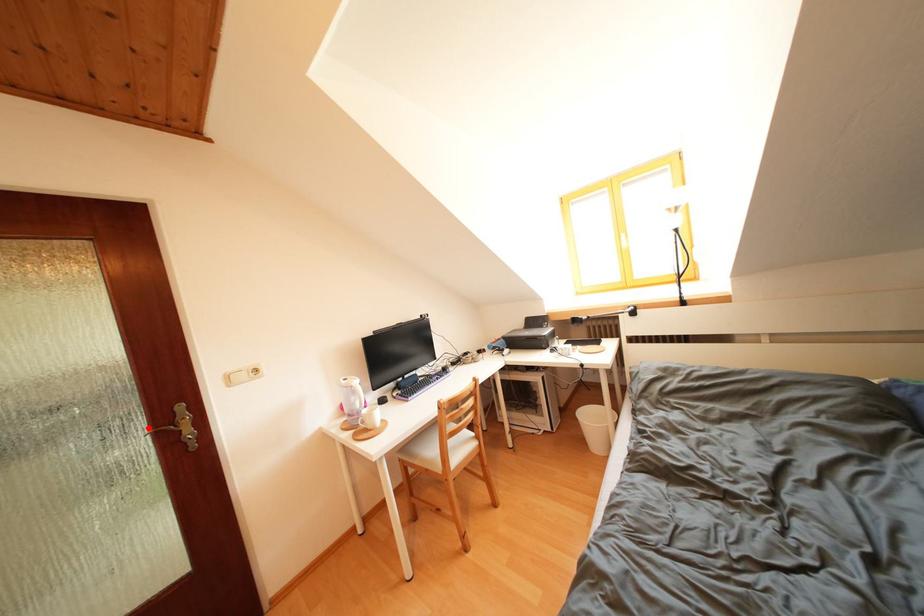
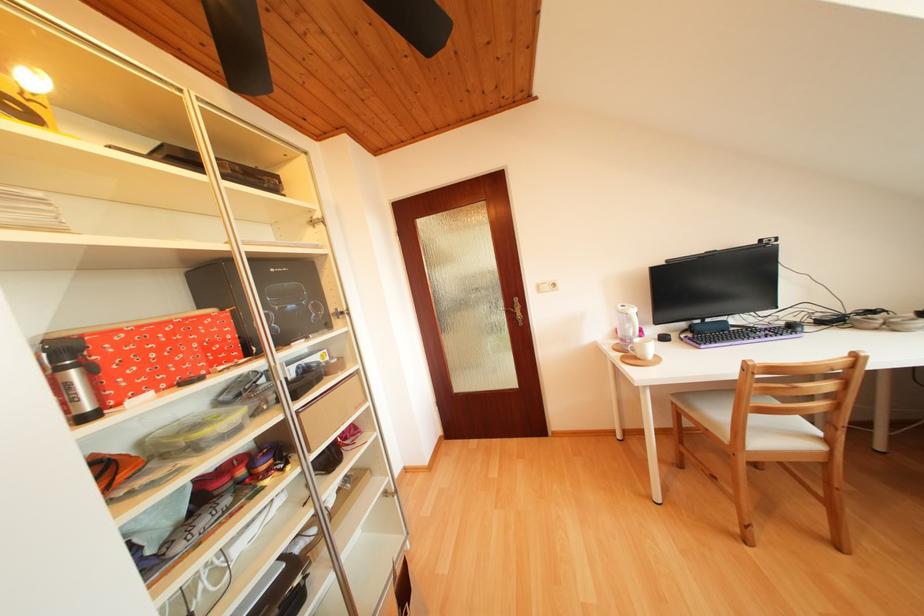
The point at the highlighted location is marked in the first image. Where is the corresponding point in the second image?

(509, 309)